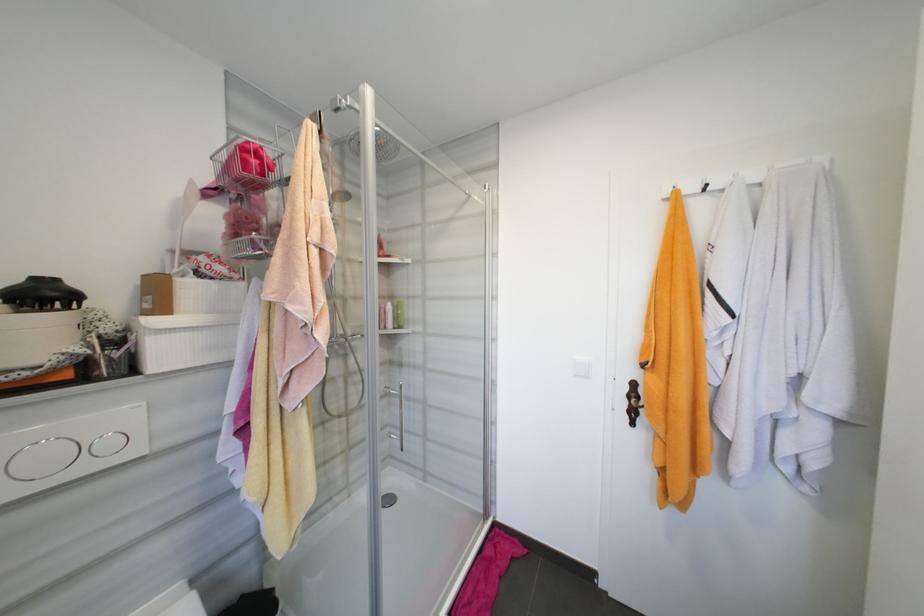
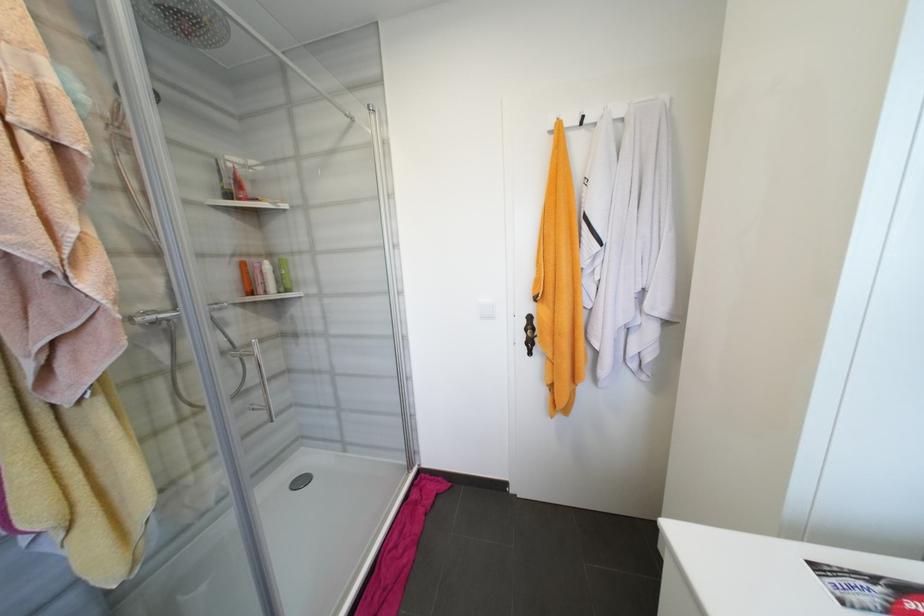
In a continuous first-person perspective shot, in which direction is the camera moving?

The movement direction of the cameraman is right, forward.